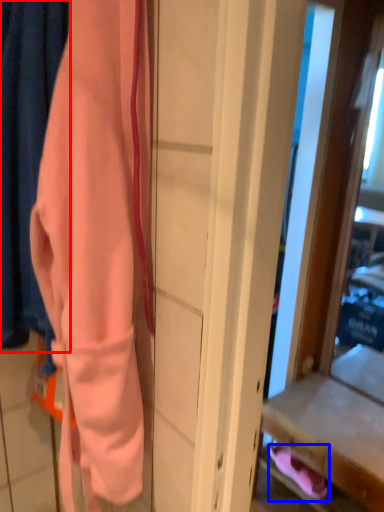
Question: Which object appears farthest to the camera in this image, curtain (highlighted by a red box) or footwear (highlighted by a blue box)?

Choices:
 (A) curtain
 (B) footwear

Answer: (B)